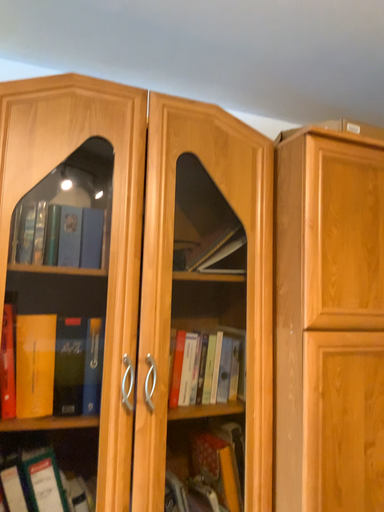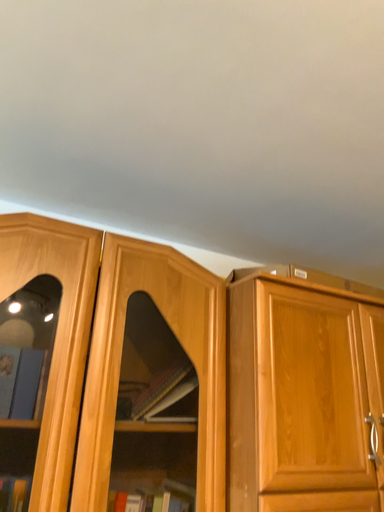
Question: Which way did the camera rotate in the video?

Choices:
 (A) rotated upward
 (B) rotated downward

Answer: (A)